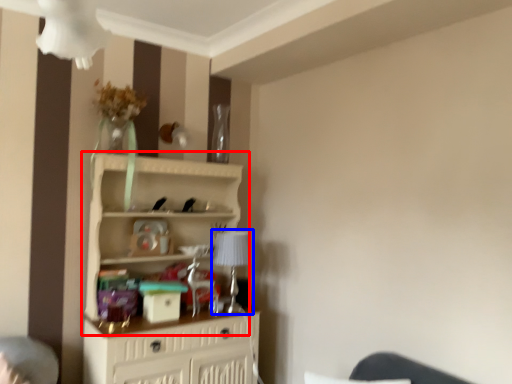
Question: Which point is further to the camera, shelf (highlighted by a red box) or table lamp (highlighted by a blue box)?

Choices:
 (A) shelf
 (B) table lamp

Answer: (B)